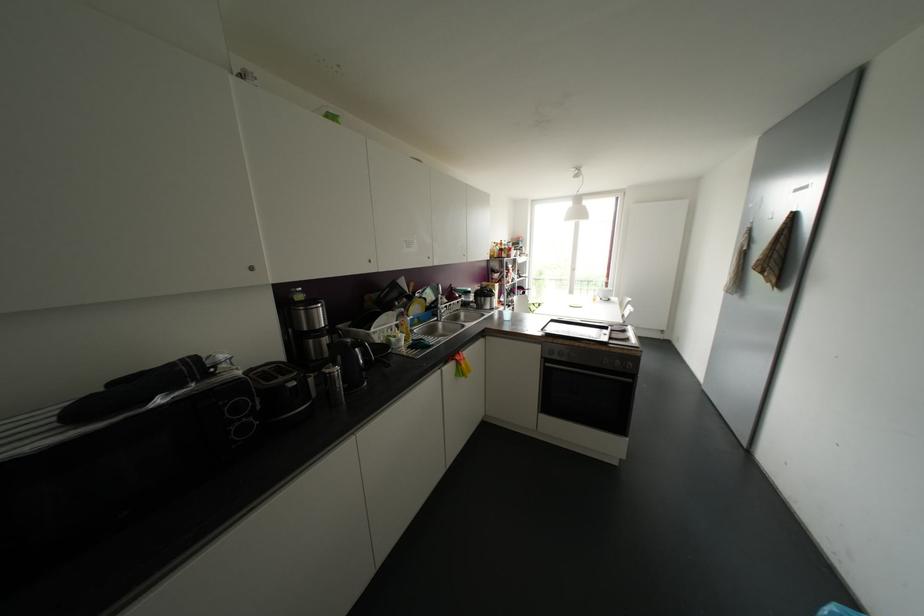
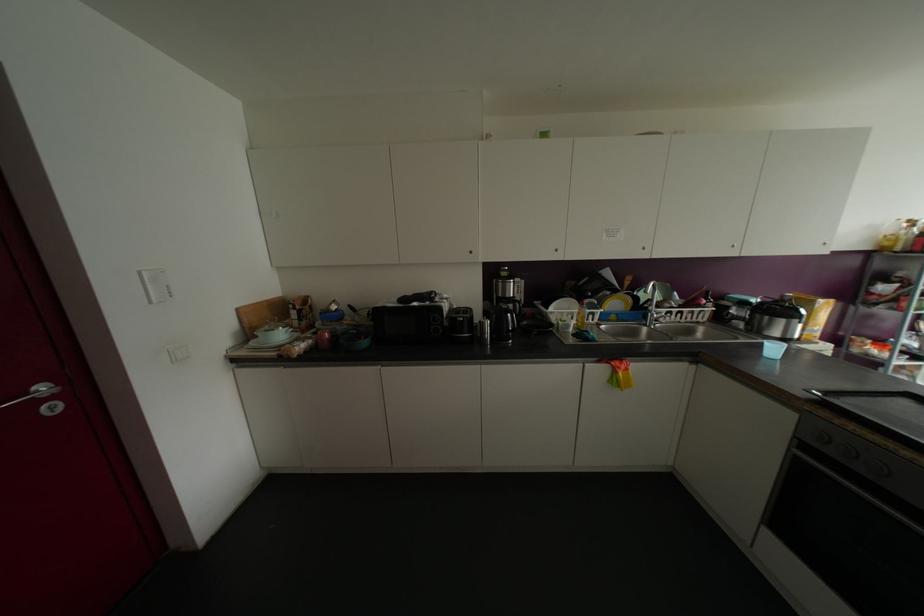
The point at (370, 261) is marked in the first image. Where is the corresponding point in the second image?

(555, 249)